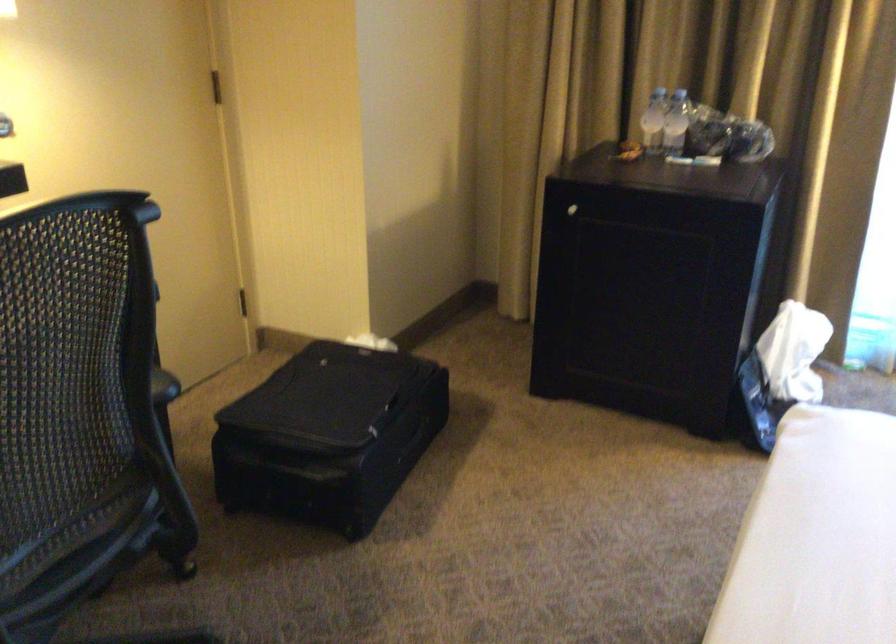
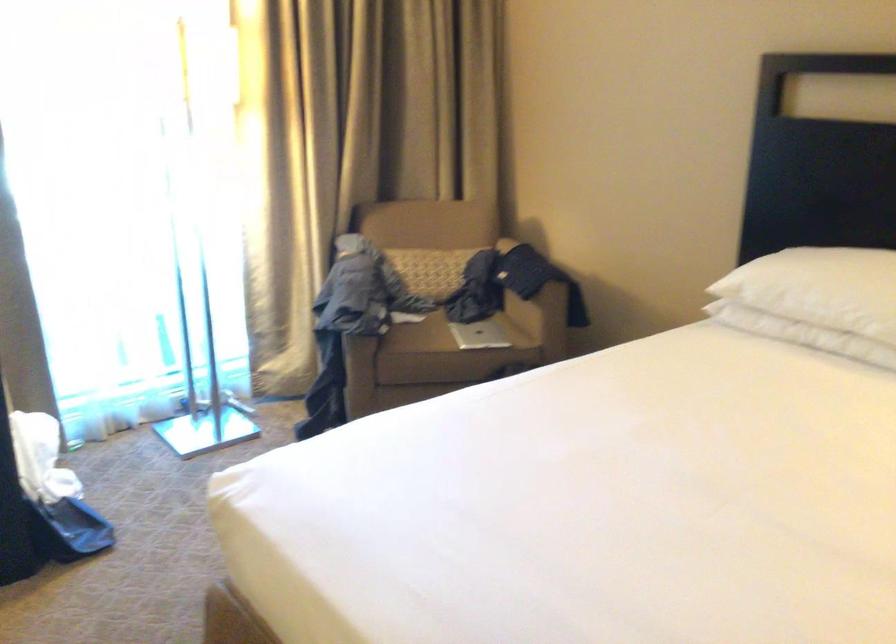
Question: The first image is from the beginning of the video and the second image is from the end. How did the camera likely rotate when shooting the video?

Choices:
 (A) Left
 (B) Right
 (C) Up
 (D) Down

Answer: (B)